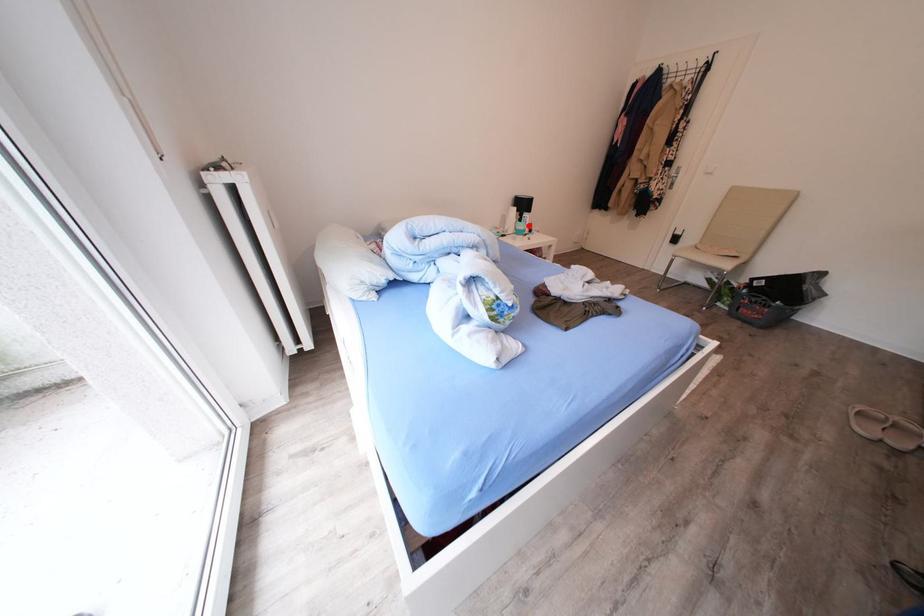
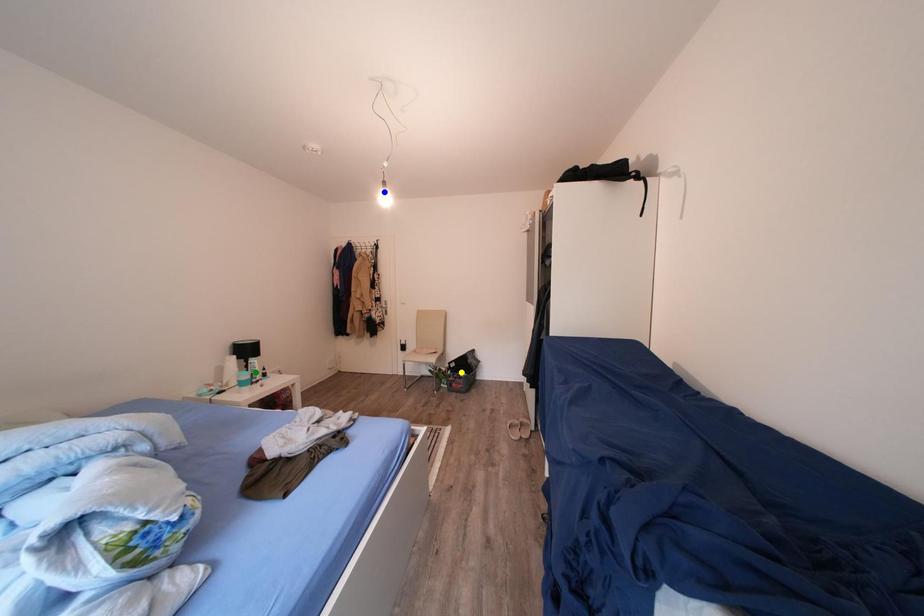
Question: I am providing you with two images of the same scene from different viewpoints. A red point is marked on the first image. You are given multiple points on the second image. Which point in image 2 is actually the same real-world point as the red point in image 1?

Choices:
 (A) yellow point
 (B) blue point
 (C) green point

Answer: (C)